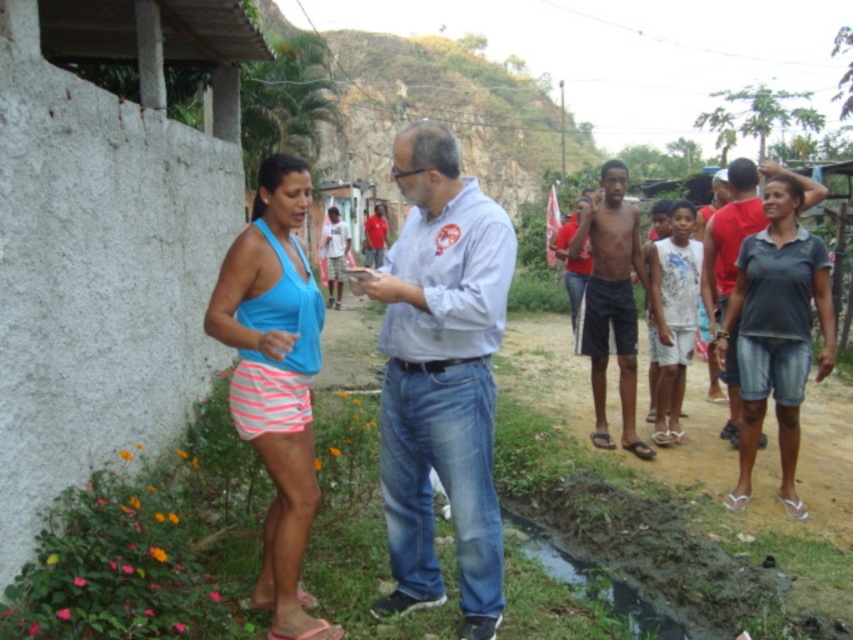
You are a fashion designer observing the scene. You need to decide which item has a larger width between the dark gray denim shorts at right and the pink fabric sandal at lower left. Which one is wider?

The dark gray denim shorts at right might be wider than pink fabric sandal at lower left.

You are a photographer trying to capture a candid shot of the matte blue tank top at center and the dark gray denim shorts at right. Since you want to ensure both subjects are in focus, which one should you focus on first to maintain depth of field?

The matte blue tank top at center is in front of the dark gray denim shorts at right, so you should focus on the matte blue tank top at center first to ensure both are in focus.